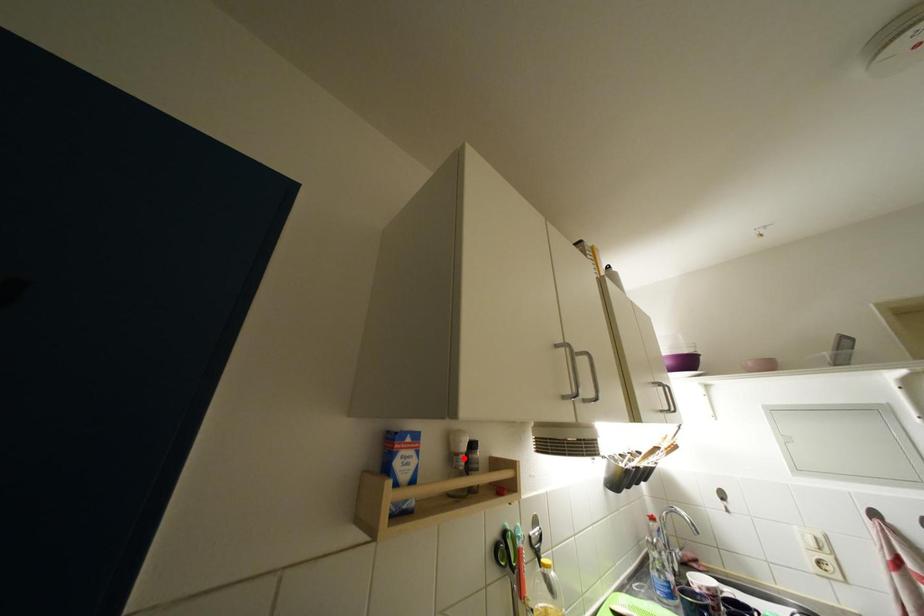
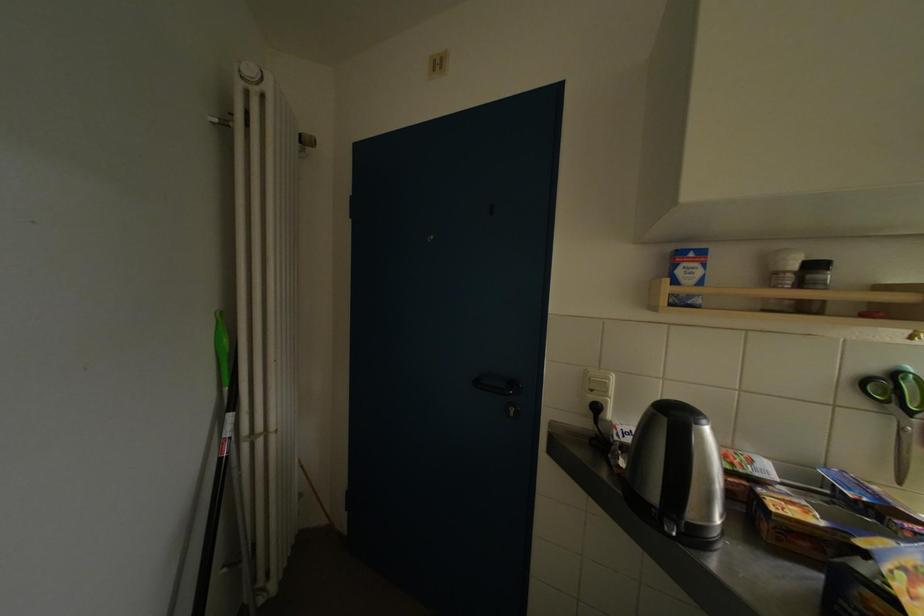
Where in the second image is the point corresponding to the highlighted location from the first image?

(784, 277)